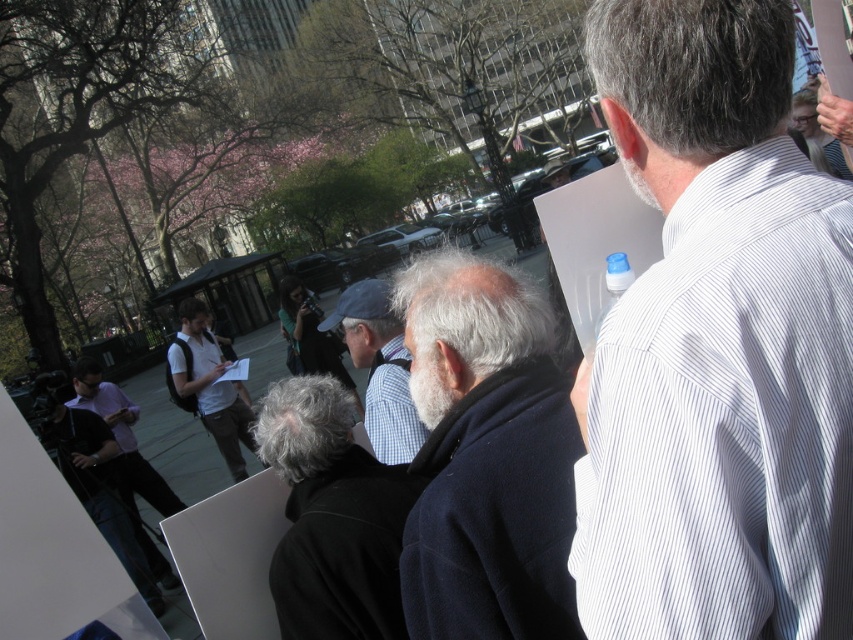
Question: Is gray woolen sweater at center closer to the viewer compared to white matte shirt at center?

Choices:
 (A) yes
 (B) no

Answer: (A)

Question: Which of the following is the closest to the observer?

Choices:
 (A) (537, 484)
 (B) (374, 278)

Answer: (A)

Question: Which point appears farthest from the camera in this image?

Choices:
 (A) (234, 390)
 (B) (490, 611)
 (C) (689, 28)

Answer: (A)

Question: Is white striped shirt at upper right to the right of dark gray wool coat at center from the viewer's perspective?

Choices:
 (A) no
 (B) yes

Answer: (B)

Question: Does dark blue wool coat at center appear on the left side of gray woolen sweater at center?

Choices:
 (A) yes
 (B) no

Answer: (B)

Question: Which object is the farthest from the white matte shirt at center?

Choices:
 (A) matte black shirt at lower left
 (B) dark gray wool coat at center

Answer: (B)